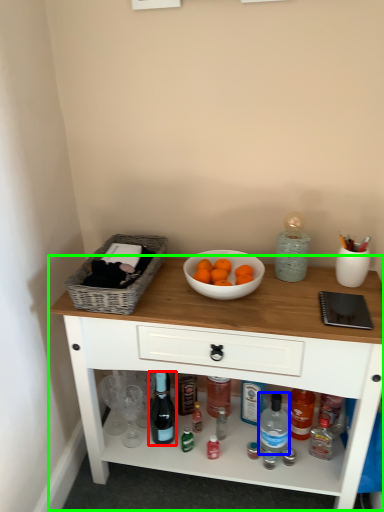
Question: Based on their relative distances, which object is farther from bottle (highlighted by a red box)? Choose from bottle (highlighted by a blue box) and table (highlighted by a green box).

Choices:
 (A) bottle
 (B) table

Answer: (B)